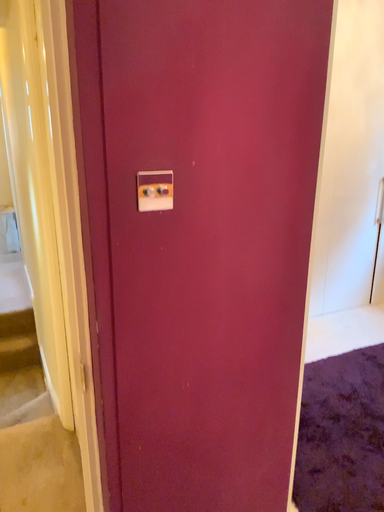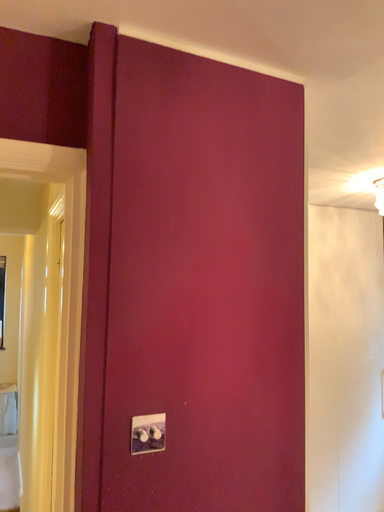
Question: Which way did the camera rotate in the video?

Choices:
 (A) rotated downward
 (B) rotated upward

Answer: (B)